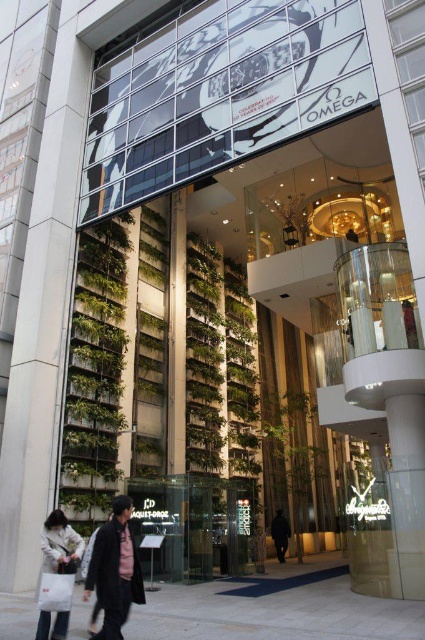
Does green leafy plant at left have a greater height compared to white fabric bag at lower left?

Correct, green leafy plant at left is much taller as white fabric bag at lower left.

Which is more to the left, green leafy plant at left or white fabric bag at lower left?

green leafy plant at left

Where is `green leafy plant at left`? This screenshot has height=640, width=425. green leafy plant at left is located at coordinates (95, 372).

Does dark gray jacket at center appear over white fabric bag at lower left?

Correct, dark gray jacket at center is located above white fabric bag at lower left.

Consider the image. Does dark gray jacket at center have a larger size compared to white fabric bag at lower left?

Indeed, dark gray jacket at center has a larger size compared to white fabric bag at lower left.

Find the location of a particular element. The image size is (425, 640). dark gray jacket at center is located at coordinates (115, 570).

How much distance is there between dark gray jacket at center and dark brown leather jacket at lower center?

dark gray jacket at center is 52.26 feet away from dark brown leather jacket at lower center.

Where is `dark gray jacket at center`? dark gray jacket at center is located at coordinates (115, 570).

What do you see at coordinates (115, 570) in the screenshot? I see `dark gray jacket at center` at bounding box center [115, 570].

Find the location of a particular element. This screenshot has height=640, width=425. dark gray jacket at center is located at coordinates (115, 570).